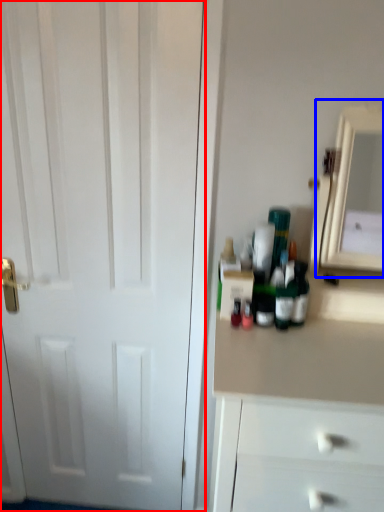
Question: Which point is further to the camera, door (highlighted by a red box) or medicine cabinet (highlighted by a blue box)?

Choices:
 (A) door
 (B) medicine cabinet

Answer: (A)